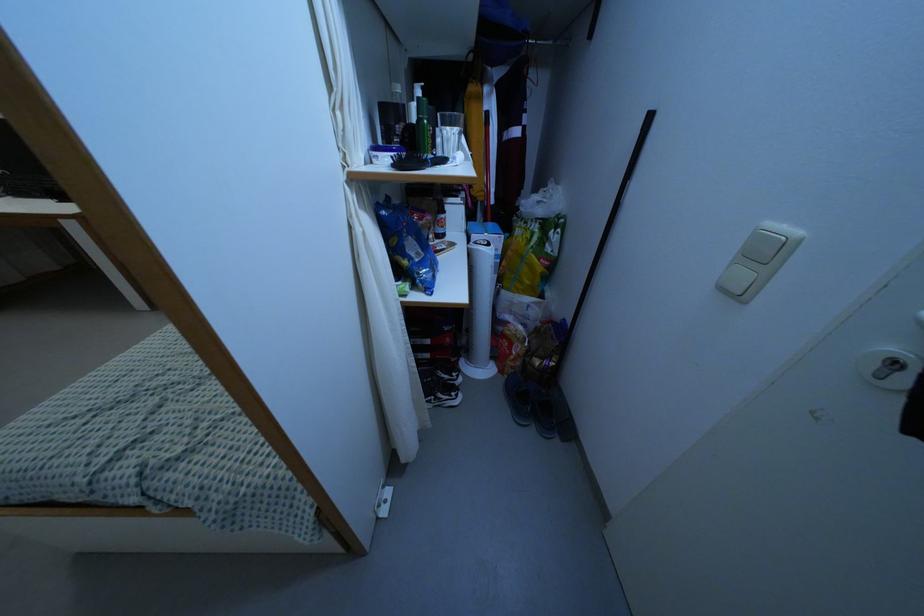
Find the location of `door keyhole`. door keyhole is located at coordinates (886, 363).